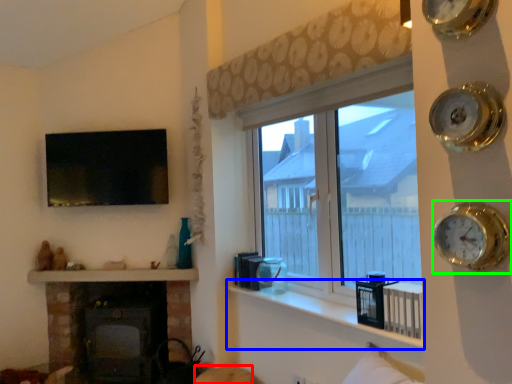
Question: Estimate the real-world distances between objects in this image. Which object is farther from furniture (highlighted by a red box), window sill (highlighted by a blue box) or clock (highlighted by a green box)?

Choices:
 (A) window sill
 (B) clock

Answer: (B)